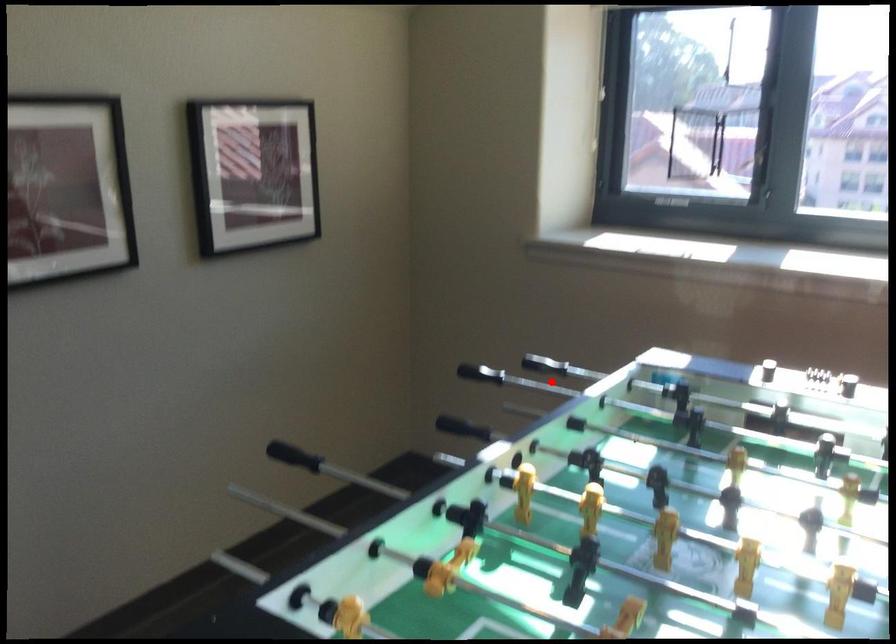
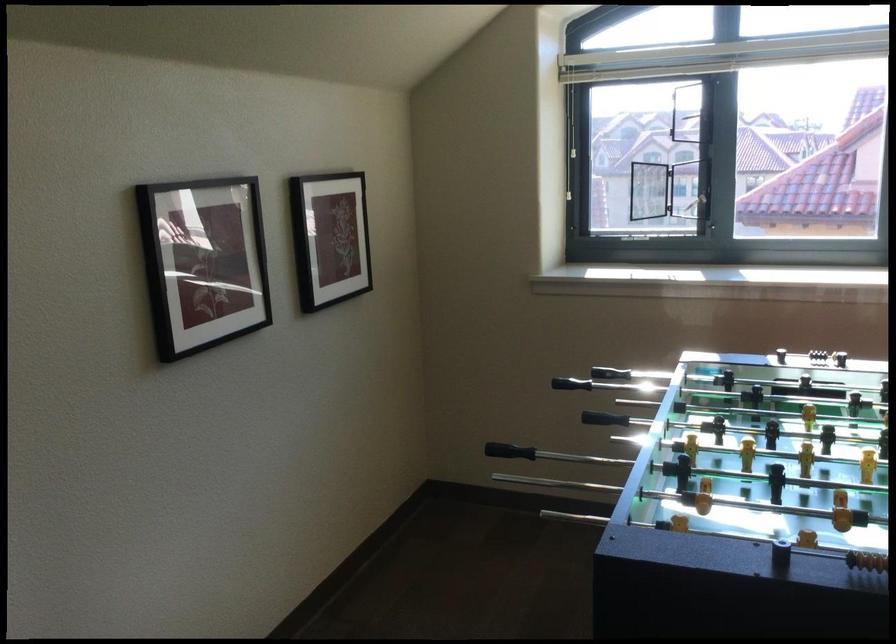
Question: A red point is marked in image1. In image2, is the corresponding 3D point closer to the camera or farther? Reply with the corresponding letter.

Choices:
 (A) The corresponding 3D point is closer.
 (B) The corresponding 3D point is farther.

Answer: (B)